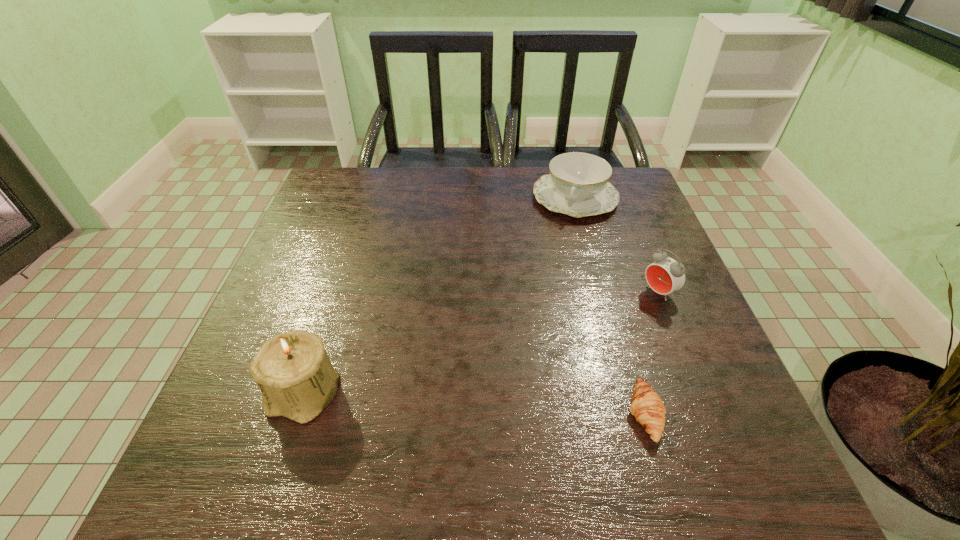
Locate an element on the screen. The height and width of the screenshot is (540, 960). candle_holder is located at coordinates (292, 369).

Locate an element on the screen. the tallest object is located at coordinates (292, 369).

The width and height of the screenshot is (960, 540). Identify the location of the shortest object. (646, 405).

The height and width of the screenshot is (540, 960). I want to click on the third nearest object, so click(x=666, y=275).

The width and height of the screenshot is (960, 540). What are the coordinates of `alarm clock` in the screenshot? It's located at (666, 275).

I want to click on the farthest object, so click(578, 185).

Where is `the second shortest object`? This screenshot has width=960, height=540. the second shortest object is located at coordinates (578, 185).

This screenshot has width=960, height=540. I want to click on free space located on the right of the leftmost object, so click(443, 393).

Locate an element on the screen. blank space located on the front-facing side of the pastry is located at coordinates (400, 414).

Identify the location of vacant space located 0.340m on the front-facing side of the pastry. (434, 414).